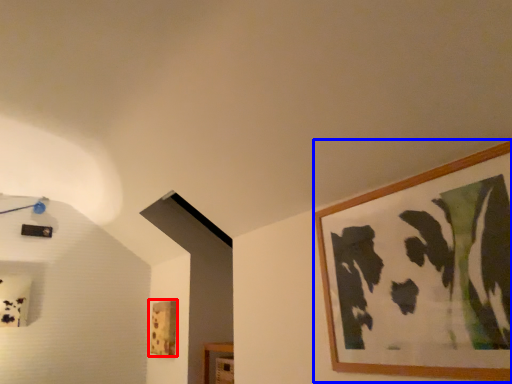
Question: Which of the following is the farthest to the observer, picture frame (highlighted by a red box) or picture frame (highlighted by a blue box)?

Choices:
 (A) picture frame
 (B) picture frame

Answer: (A)